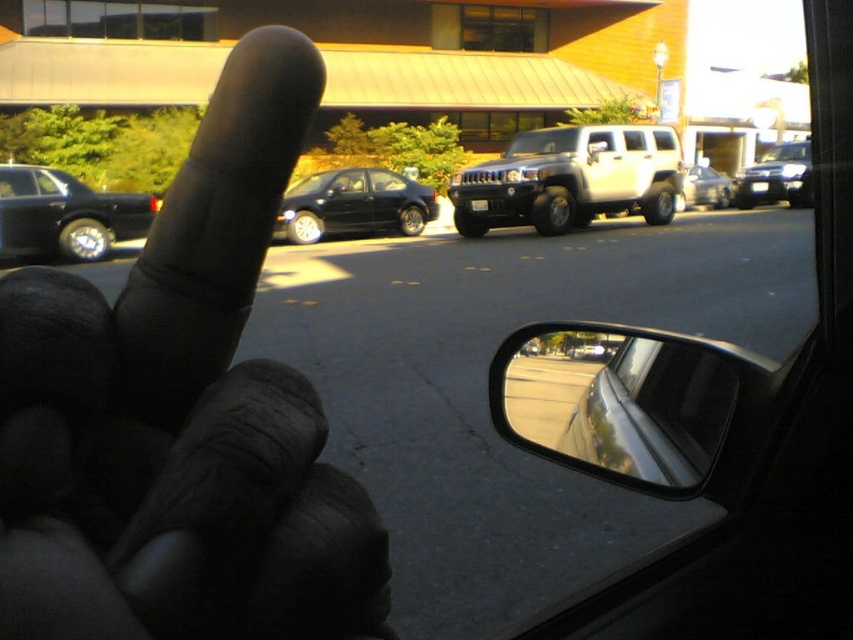
You are a driver trying to exit the parking lot and need to know the position of the vehicles. Which vehicle is closer to you, the white matte suv at center or the matte black sedan at center?

The white matte suv at center is closer to you because it is in front of the matte black sedan at center.

Based on the photo, you are a driver looking at the side mirror of your vehicle. There is a point marked at coordinates (183, 417) in the mirror. Where is this point located?

The point marked at coordinates (183, 417) is on the black matte finger at upper left.